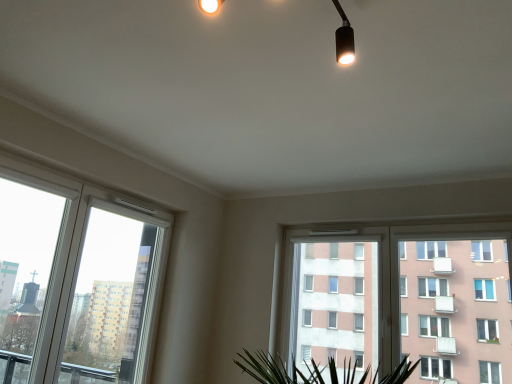
Question: Does white plastic window at left, the 1th window in the left-to-right sequence, have a larger size compared to white plastic window at center, arranged as the first window when viewed from the right?

Choices:
 (A) yes
 (B) no

Answer: (B)

Question: Does white plastic window at left, the 1th window in the left-to-right sequence, come behind white plastic window at center, arranged as the first window when viewed from the right?

Choices:
 (A) yes
 (B) no

Answer: (B)

Question: Can you confirm if white plastic window at left, which ranks as the 2th window in right-to-left order, is thinner than white plastic window at center, the 2th window positioned from the left?

Choices:
 (A) yes
 (B) no

Answer: (A)

Question: Can white plastic window at center, the 2th window positioned from the left, be found inside white plastic window at left, the 1th window in the left-to-right sequence?

Choices:
 (A) no
 (B) yes

Answer: (A)

Question: Does white plastic window at left, which ranks as the 2th window in right-to-left order, have a smaller size compared to white plastic window at center, arranged as the first window when viewed from the right?

Choices:
 (A) no
 (B) yes

Answer: (B)

Question: From a real-world perspective, is white plastic window at left, which ranks as the 2th window in right-to-left order, positioned under white plastic window at center, the 2th window positioned from the left, based on gravity?

Choices:
 (A) yes
 (B) no

Answer: (A)

Question: Is white plastic window at center, arranged as the first window when viewed from the right, positioned with its back to white plastic window at left, which ranks as the 2th window in right-to-left order?

Choices:
 (A) no
 (B) yes

Answer: (A)

Question: From a real-world perspective, is white plastic window at center, the 2th window positioned from the left, on top of white plastic window at left, the 1th window in the left-to-right sequence?

Choices:
 (A) yes
 (B) no

Answer: (A)

Question: Does white plastic window at center, the 2th window positioned from the left, have a greater height compared to white plastic window at left, which ranks as the 2th window in right-to-left order?

Choices:
 (A) no
 (B) yes

Answer: (A)

Question: Is white plastic window at center, arranged as the first window when viewed from the right, not near white plastic window at left, which ranks as the 2th window in right-to-left order?

Choices:
 (A) yes
 (B) no

Answer: (A)

Question: Is white plastic window at center, the 2th window positioned from the left, oriented towards white plastic window at left, which ranks as the 2th window in right-to-left order?

Choices:
 (A) yes
 (B) no

Answer: (B)

Question: Does white plastic window at center, arranged as the first window when viewed from the right, have a lesser width compared to white plastic window at left, the 1th window in the left-to-right sequence?

Choices:
 (A) yes
 (B) no

Answer: (B)

Question: Looking at the image, does white plastic window at center, arranged as the first window when viewed from the right, seem bigger or smaller compared to white plastic window at left, which ranks as the 2th window in right-to-left order?

Choices:
 (A) big
 (B) small

Answer: (A)